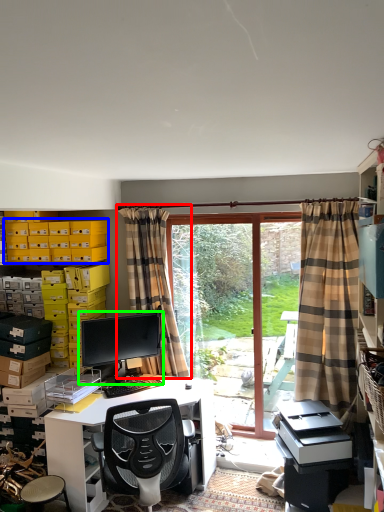
Question: Estimate the real-world distances between objects in this image. Which object is farther from curtain (highlighted by a red box), storage box (highlighted by a blue box) or computer monitor (highlighted by a green box)?

Choices:
 (A) storage box
 (B) computer monitor

Answer: (A)